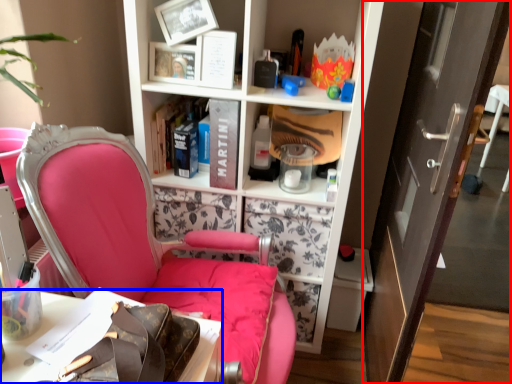
Question: Which point is further to the camera, door (highlighted by a red box) or desk (highlighted by a blue box)?

Choices:
 (A) door
 (B) desk

Answer: (A)